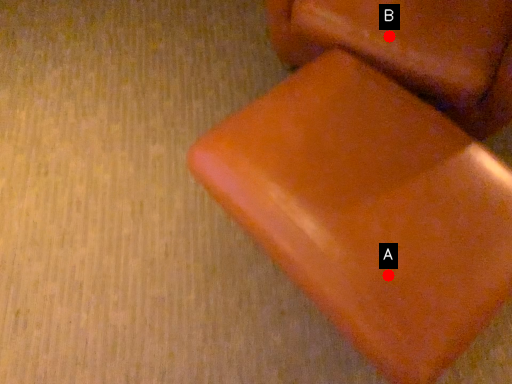
Question: Two points are circled on the image, labeled by A and B beside each circle. Which point is farther from the camera taking this photo?

Choices:
 (A) A is further
 (B) B is further

Answer: (B)